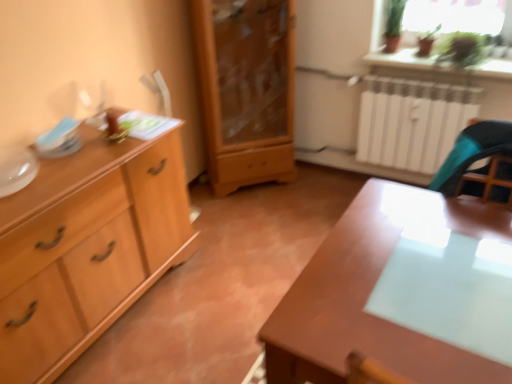
In order to click on vacant area that is situated to the right of light wood cabinet at left, positioned as the 2th chest of drawers in right-to-left order in this screenshot , I will do `click(206, 301)`.